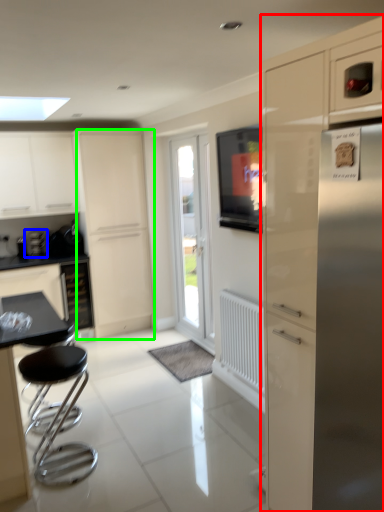
Question: Which object is the farthest from cabinetry (highlighted by a red box)? Choose among these: coffee machine (highlighted by a blue box) or screen door (highlighted by a green box).

Choices:
 (A) coffee machine
 (B) screen door

Answer: (A)